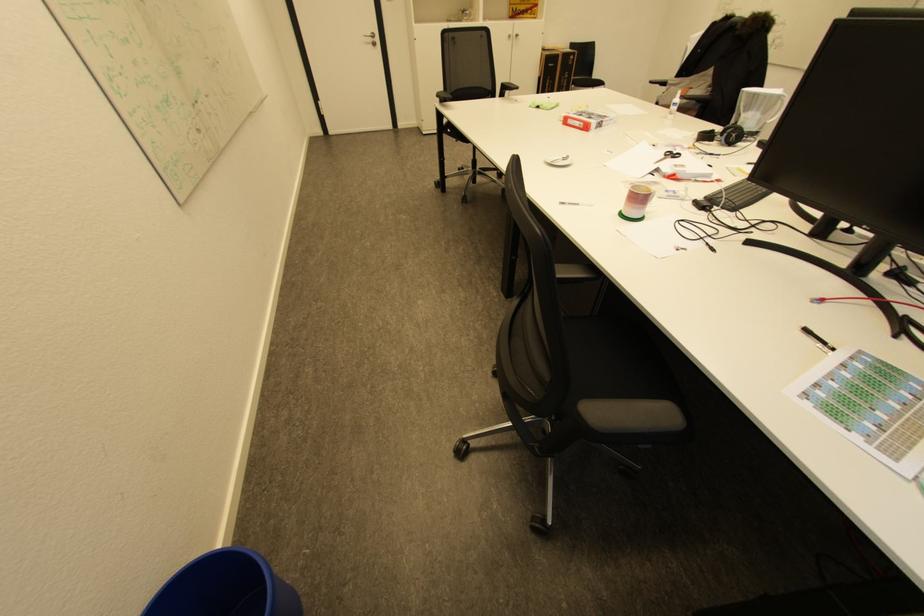
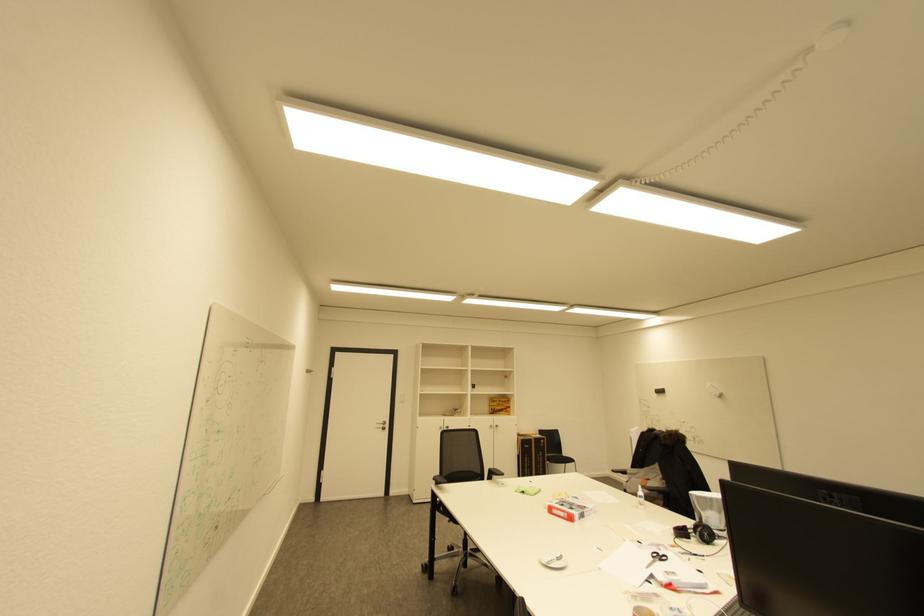
Locate, in the second image, the point that corresponds to [570,159] in the first image.

(564, 559)